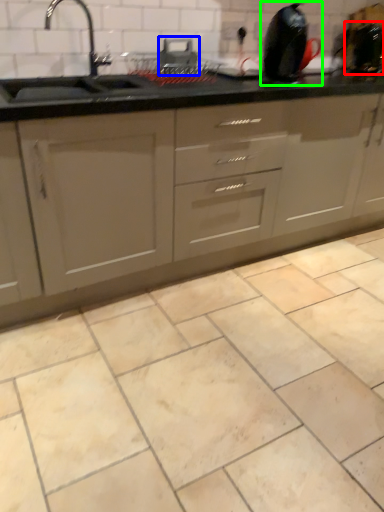
Question: Which object is positioned closest to appliance (highlighted by a red box)? Select from appliance (highlighted by a blue box) and appliance (highlighted by a green box).

Choices:
 (A) appliance
 (B) appliance

Answer: (B)